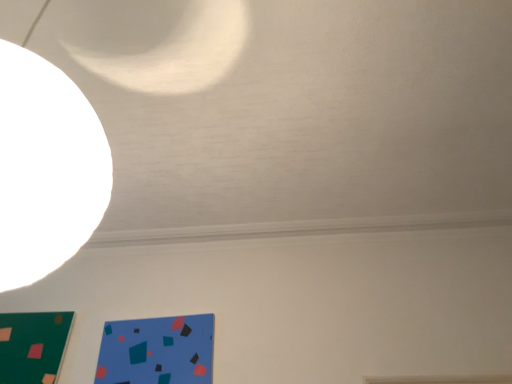
Question: Would you say blue matte paper at lower left contains green matte board at lower left?

Choices:
 (A) yes
 (B) no

Answer: (B)

Question: Is the position of blue matte paper at lower left less distant than that of green matte board at lower left?

Choices:
 (A) no
 (B) yes

Answer: (B)

Question: Is blue matte paper at lower left beside green matte board at lower left?

Choices:
 (A) yes
 (B) no

Answer: (B)

Question: From the image's perspective, is blue matte paper at lower left over green matte board at lower left?

Choices:
 (A) no
 (B) yes

Answer: (B)

Question: From a real-world perspective, is blue matte paper at lower left physically below green matte board at lower left?

Choices:
 (A) no
 (B) yes

Answer: (B)

Question: Is blue matte paper at lower left facing away from green matte board at lower left?

Choices:
 (A) no
 (B) yes

Answer: (A)

Question: Considering the relative sizes of green matte board at lower left and blue matte paper at lower left in the image provided, is green matte board at lower left smaller than blue matte paper at lower left?

Choices:
 (A) no
 (B) yes

Answer: (B)

Question: Would you say green matte board at lower left is a long distance from blue matte paper at lower left?

Choices:
 (A) no
 (B) yes

Answer: (A)

Question: From the image's perspective, is green matte board at lower left located above blue matte paper at lower left?

Choices:
 (A) no
 (B) yes

Answer: (A)

Question: From the image's perspective, is green matte board at lower left located beneath blue matte paper at lower left?

Choices:
 (A) yes
 (B) no

Answer: (A)

Question: Is green matte board at lower left oriented towards blue matte paper at lower left?

Choices:
 (A) yes
 (B) no

Answer: (B)

Question: Can you confirm if green matte board at lower left is taller than blue matte paper at lower left?

Choices:
 (A) yes
 (B) no

Answer: (A)

Question: Is green matte board at lower left taller or shorter than blue matte paper at lower left?

Choices:
 (A) short
 (B) tall

Answer: (B)